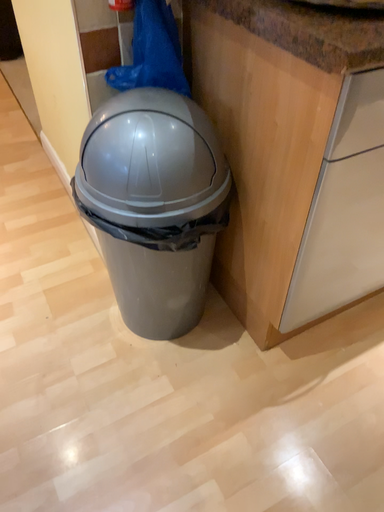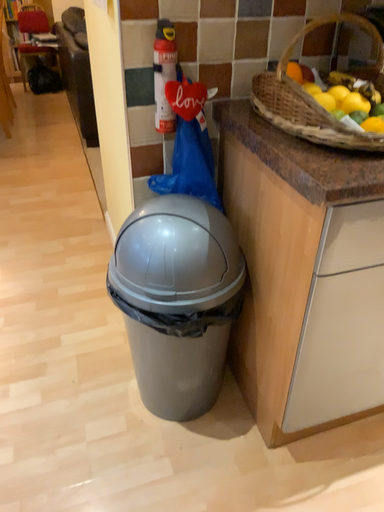
Question: Which way did the camera rotate in the video?

Choices:
 (A) rotated right
 (B) rotated left

Answer: (B)